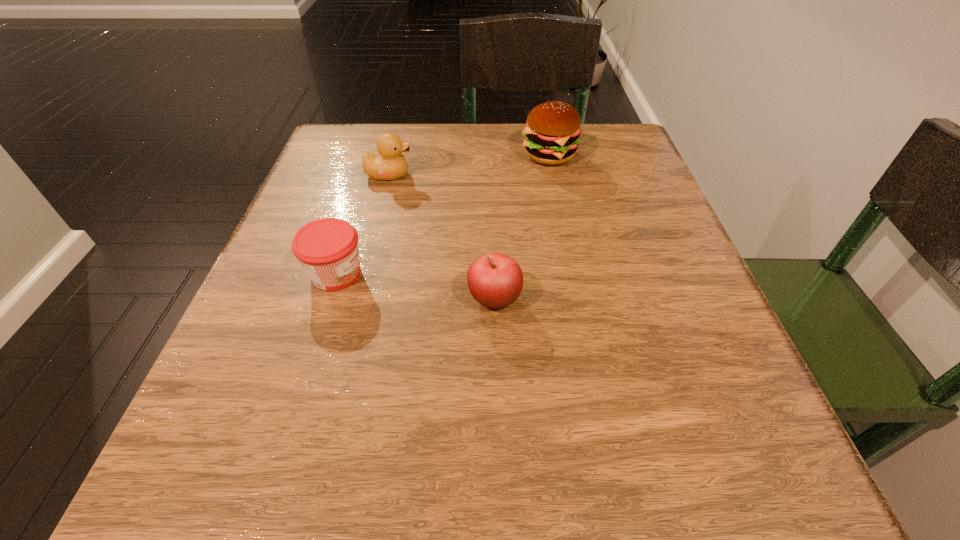
In the image, there is a desktop. At what (x,y) coordinates should I click in order to perform the action: click on vacant space at the far right corner. Please return your answer as a coordinate pair (x, y). Looking at the image, I should click on (x=626, y=157).

The width and height of the screenshot is (960, 540). In the image, there is a desktop. Find the location of `vacant region at the near right corner`. vacant region at the near right corner is located at coordinates (765, 461).

Where is `vacant space that's between the jam and the third object from left to right`? vacant space that's between the jam and the third object from left to right is located at coordinates (415, 286).

At what (x,y) coordinates should I click in order to perform the action: click on empty space that is in between the duckling and the tallest object. Please return your answer as a coordinate pair (x, y). Looking at the image, I should click on (469, 165).

Find the location of `vacant space that is in between the tallest object and the jam`. vacant space that is in between the tallest object and the jam is located at coordinates (443, 214).

Image resolution: width=960 pixels, height=540 pixels. In order to click on empty space between the jam and the duckling in this screenshot , I will do `click(363, 224)`.

Image resolution: width=960 pixels, height=540 pixels. I want to click on free space between the tallest object and the jam, so [443, 214].

The height and width of the screenshot is (540, 960). What are the coordinates of `free spot between the duckling and the jam` in the screenshot? It's located at (363, 224).

The width and height of the screenshot is (960, 540). I want to click on vacant space in between the jam and the rightmost object, so click(x=443, y=214).

Where is `free area in between the duckling and the jam`? This screenshot has width=960, height=540. free area in between the duckling and the jam is located at coordinates (363, 224).